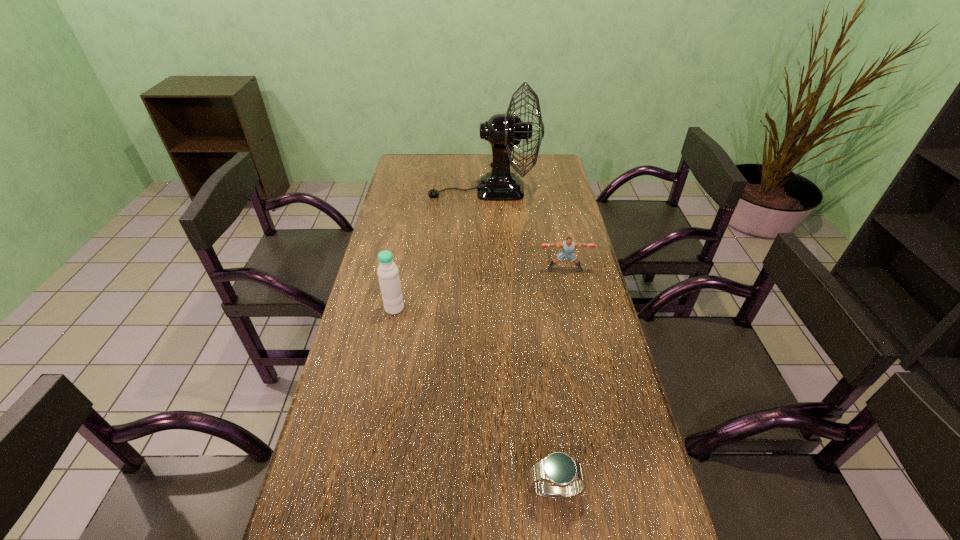
At what (x,y) coordinates should I click in order to perform the action: click on the farthest object. Please return your answer as a coordinate pair (x, y). This screenshot has height=540, width=960. Looking at the image, I should click on (504, 131).

This screenshot has height=540, width=960. Identify the location of the tallest object. (504, 131).

Where is `the leftmost object`? This screenshot has height=540, width=960. the leftmost object is located at coordinates (388, 273).

Where is `the second nearest object`? This screenshot has width=960, height=540. the second nearest object is located at coordinates (388, 273).

What are the coordinates of `puncher` in the screenshot? It's located at (568, 245).

Find the location of a particular element. The image size is (960, 540). the second farthest object is located at coordinates (568, 245).

Locate an element on the screen. the shortest object is located at coordinates (565, 477).

Identify the location of watch. The height and width of the screenshot is (540, 960). pyautogui.click(x=565, y=477).

The width and height of the screenshot is (960, 540). Identify the location of vacant space located 0.110m in front of the farthest object, indicating the direction of air flow. (403, 190).

This screenshot has width=960, height=540. Find the location of `free space located 0.160m in front of the farthest object, indicating the direction of air flow`. free space located 0.160m in front of the farthest object, indicating the direction of air flow is located at coordinates (391, 190).